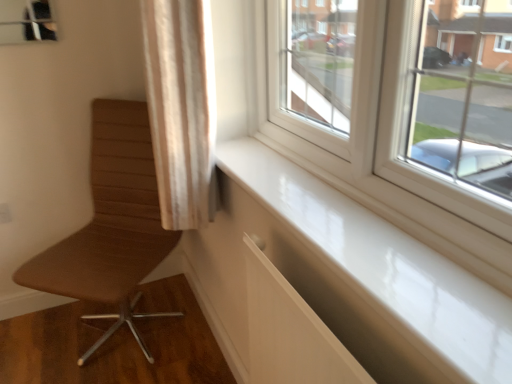
Question: Is the position of white glossy window sill at lower right less distant than that of beige fabric curtain at upper left?

Choices:
 (A) no
 (B) yes

Answer: (B)

Question: Could you tell me if white glossy window sill at lower right is turned towards beige fabric curtain at upper left?

Choices:
 (A) yes
 (B) no

Answer: (B)

Question: Is white glossy window sill at lower right behind beige fabric curtain at upper left?

Choices:
 (A) yes
 (B) no

Answer: (B)

Question: Is white glossy window sill at lower right next to beige fabric curtain at upper left and touching it?

Choices:
 (A) yes
 (B) no

Answer: (B)

Question: Would you say white glossy window sill at lower right contains beige fabric curtain at upper left?

Choices:
 (A) no
 (B) yes

Answer: (A)

Question: From a real-world perspective, is brown leather chair at left positioned above or below beige fabric curtain at upper left?

Choices:
 (A) above
 (B) below

Answer: (B)

Question: Is point (78, 273) closer or farther from the camera than point (157, 24)?

Choices:
 (A) closer
 (B) farther

Answer: (B)

Question: In the image, is brown leather chair at left positioned in front of or behind beige fabric curtain at upper left?

Choices:
 (A) front
 (B) behind

Answer: (B)

Question: From their relative heights in the image, would you say brown leather chair at left is taller or shorter than beige fabric curtain at upper left?

Choices:
 (A) tall
 (B) short

Answer: (A)

Question: Considering their positions, is beige fabric curtain at upper left located in front of or behind white glossy window sill at lower right?

Choices:
 (A) behind
 (B) front

Answer: (A)

Question: Considering the relative positions of beige fabric curtain at upper left and white glossy window sill at lower right in the image provided, is beige fabric curtain at upper left to the left or to the right of white glossy window sill at lower right?

Choices:
 (A) right
 (B) left

Answer: (B)

Question: In terms of width, does beige fabric curtain at upper left look wider or thinner when compared to white glossy window sill at lower right?

Choices:
 (A) thin
 (B) wide

Answer: (B)

Question: From the image's perspective, is beige fabric curtain at upper left above or below white glossy window sill at lower right?

Choices:
 (A) below
 (B) above

Answer: (B)

Question: Relative to beige fabric curtain at upper left, is white glossy window sill at lower right in front or behind?

Choices:
 (A) front
 (B) behind

Answer: (A)

Question: Considering the positions of point (480, 301) and point (210, 205), is point (480, 301) closer or farther from the camera than point (210, 205)?

Choices:
 (A) closer
 (B) farther

Answer: (A)